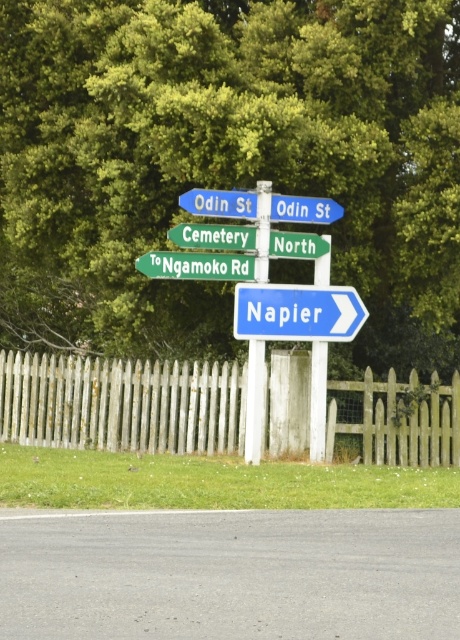
Question: Considering the real-world distances, which object is farthest from the green plastic sign at center?

Choices:
 (A) green plastic sign at upper center
 (B) white wooden pole at center

Answer: (B)

Question: Which point appears closest to the camera in this image?

Choices:
 (A) (318, 429)
 (B) (229, 244)
 (C) (206, 208)
 (D) (236, 324)

Answer: (C)

Question: Does green plastic sign at center have a lesser width compared to white wooden pole at center?

Choices:
 (A) no
 (B) yes

Answer: (A)

Question: Estimate the real-world distances between objects in this image. Which object is farther from the blue plastic street sign at upper center?

Choices:
 (A) white wooden pole at center
 (B) blue plastic sign at center right

Answer: (A)

Question: Does blue plastic sign at center right have a greater width compared to green plastic sign at upper center?

Choices:
 (A) yes
 (B) no

Answer: (A)

Question: Can you confirm if white wooden fence at lower center is positioned below green plastic sign at upper center?

Choices:
 (A) yes
 (B) no

Answer: (A)